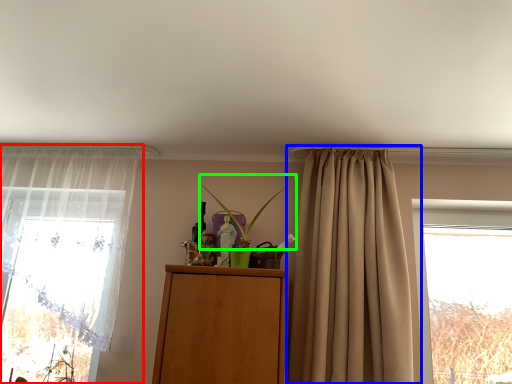
Question: Estimate the real-world distances between objects in this image. Which object is closer to curtain (highlighted by a red box), curtain (highlighted by a blue box) or plant (highlighted by a green box)?

Choices:
 (A) curtain
 (B) plant

Answer: (B)